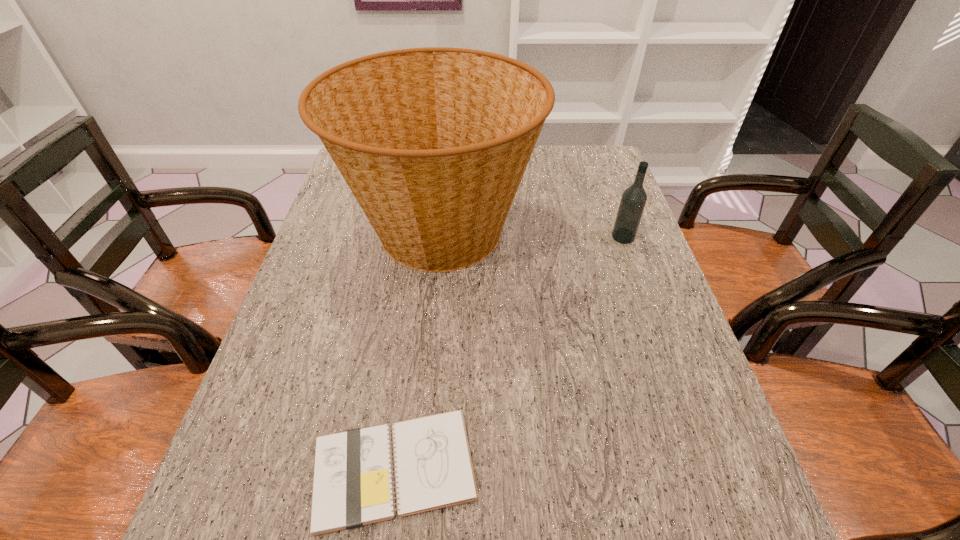
Locate which object ranks in proximity to the basket. Please provide its 2D coordinates. Your answer should be formatted as a tuple, i.e. [(x, y)], where the tuple contains the x and y coordinates of a point satisfying the conditions above.

[(633, 200)]

At what (x,y) coordinates should I click in order to perform the action: click on vacant region that satisfies the following two spatial constraints: 1. on the back side of the basket; 2. on the right side of the nearest object. Please return your answer as a coordinate pair (x, y). Image resolution: width=960 pixels, height=540 pixels. Looking at the image, I should click on (426, 230).

The image size is (960, 540). I want to click on free location that satisfies the following two spatial constraints: 1. on the front side of the vodka; 2. on the left side of the tallest object, so click(x=439, y=237).